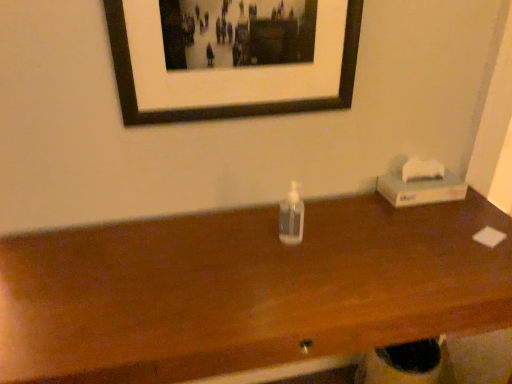
Identify the location of free spot above transparent plastic bottle at center (from a real-world perspective). This screenshot has width=512, height=384. (252, 256).